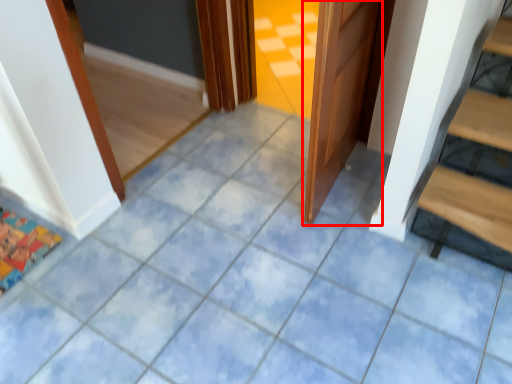
Question: From the image's perspective, where is door (annotated by the red box) located in relation to doormat in the image?

Choices:
 (A) below
 (B) above

Answer: (B)